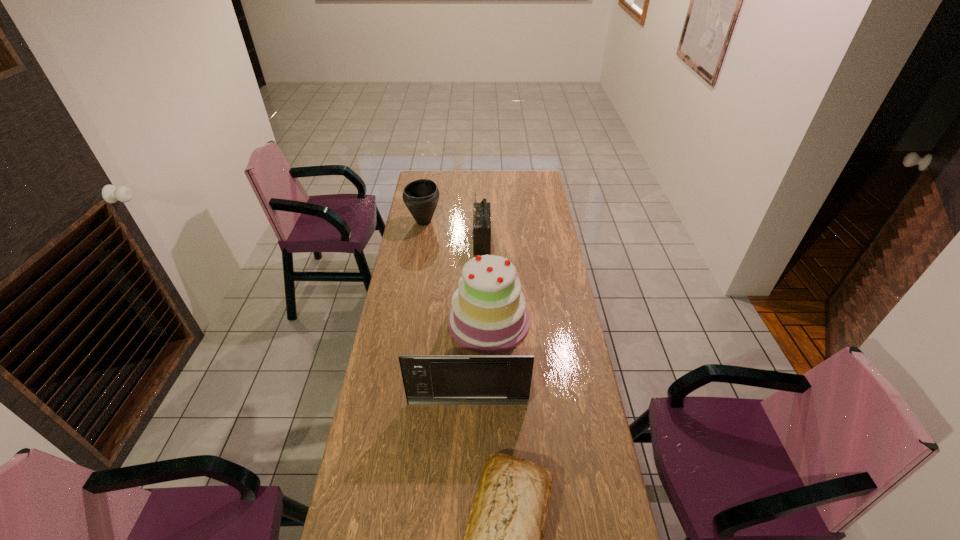
Locate an element on the screen. The height and width of the screenshot is (540, 960). microwave oven present at the left edge is located at coordinates (428, 379).

Identify the location of urn present at the left edge. The width and height of the screenshot is (960, 540). (421, 196).

Find the location of a particular element. This screenshot has height=540, width=960. free space at the far edge of the desktop is located at coordinates (474, 172).

You are a GUI agent. You are given a task and a screenshot of the screen. Output one action in this format:
    pyautogui.click(x=<x>, y=<y>)
    Task: Click on the vacant space at the left edge of the desktop
    
    Given the screenshot: What is the action you would take?
    pyautogui.click(x=408, y=224)

In the image, there is a desktop. Identify the location of vacant space at the right edge. (576, 504).

At what (x,y) coordinates should I click in order to perform the action: click on free space at the far right corner of the desktop. Please return your answer as a coordinate pair (x, y). This screenshot has height=540, width=960. Looking at the image, I should click on (547, 191).

The width and height of the screenshot is (960, 540). Identify the location of empty location between the urn and the cake. (456, 272).

Identify the location of unoccupied position between the second shortest object and the cake. (456, 272).

Find the location of a particular element. The width and height of the screenshot is (960, 540). unoccupied position between the urn and the second nearest object is located at coordinates (445, 312).

Select which object is the fourth closest to the cake. Please provide its 2D coordinates. Your answer should be formatted as a tuple, i.e. [(x, y)], where the tuple contains the x and y coordinates of a point satisfying the conditions above.

[(421, 196)]